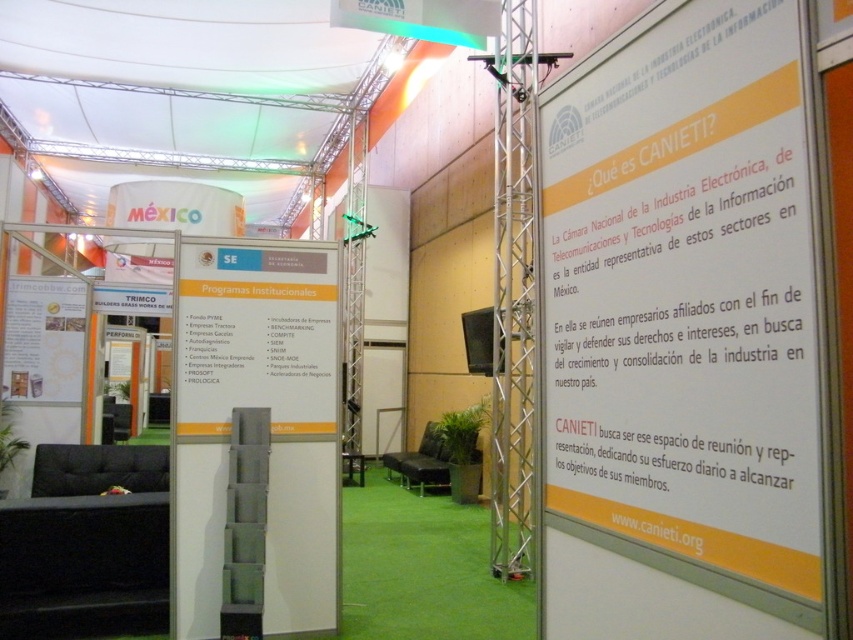
In the scene shown: You are at the CANIETI booth and notice two signs, the yellow paperboard sign at right and the white cardboard sign at left. Which sign is shorter?

The yellow paperboard sign at right is shorter than the white cardboard sign at left.

You are standing at the entrance of the CANIETI booth and see a yellow paperboard sign at right and a camera. Which object is closer to you?

Both the yellow paperboard sign at right and the camera are 1.35 meters away from you.